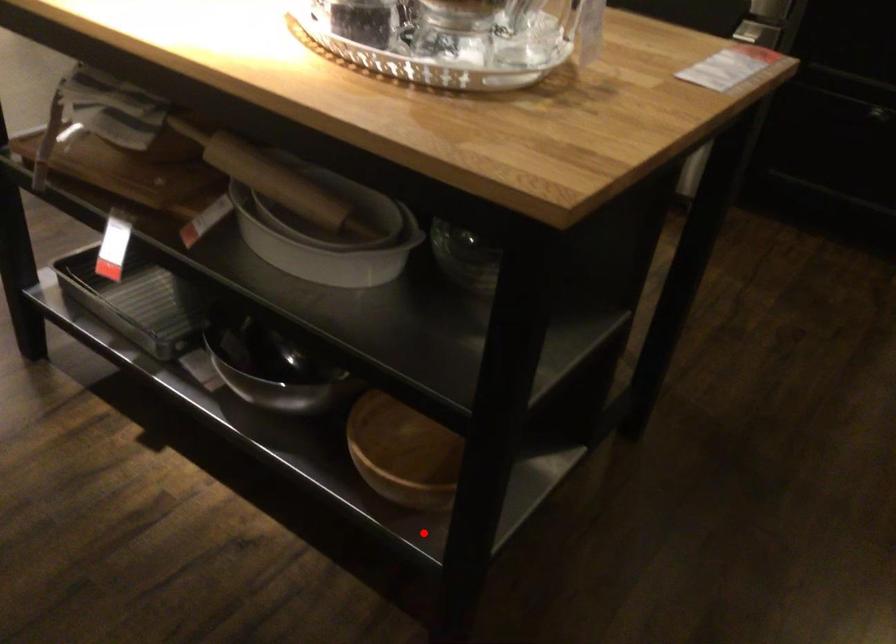
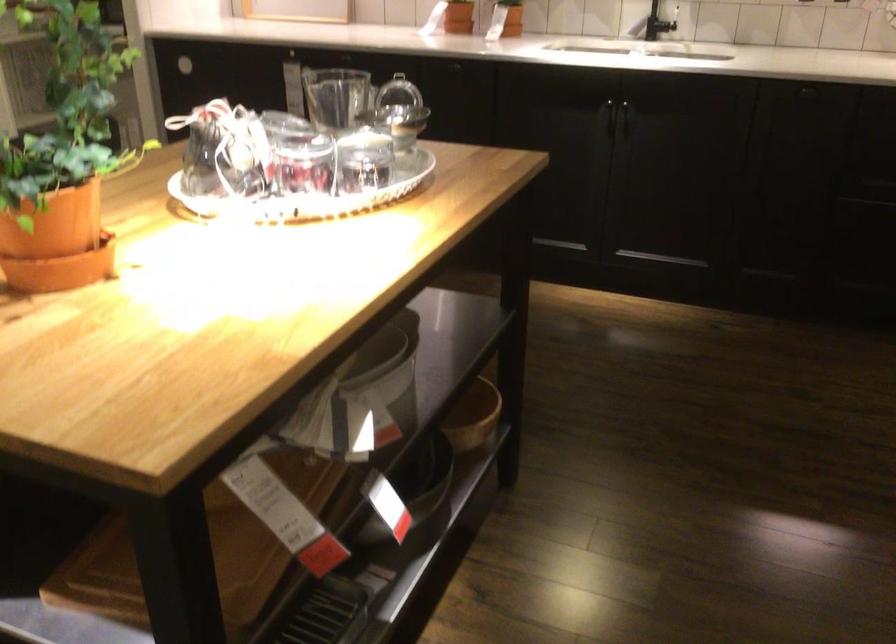
Question: A red point is marked in image1. In image2, is the corresponding 3D point closer to the camera or farther? Reply with the corresponding letter.

Choices:
 (A) The corresponding 3D point is closer.
 (B) The corresponding 3D point is farther.

Answer: (B)